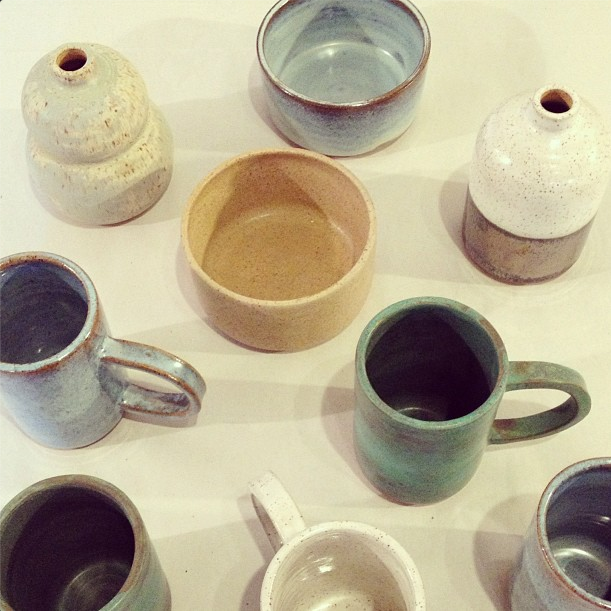
This screenshot has width=611, height=611. Find the location of `bowl`. bowl is located at coordinates (308, 258), (348, 35).